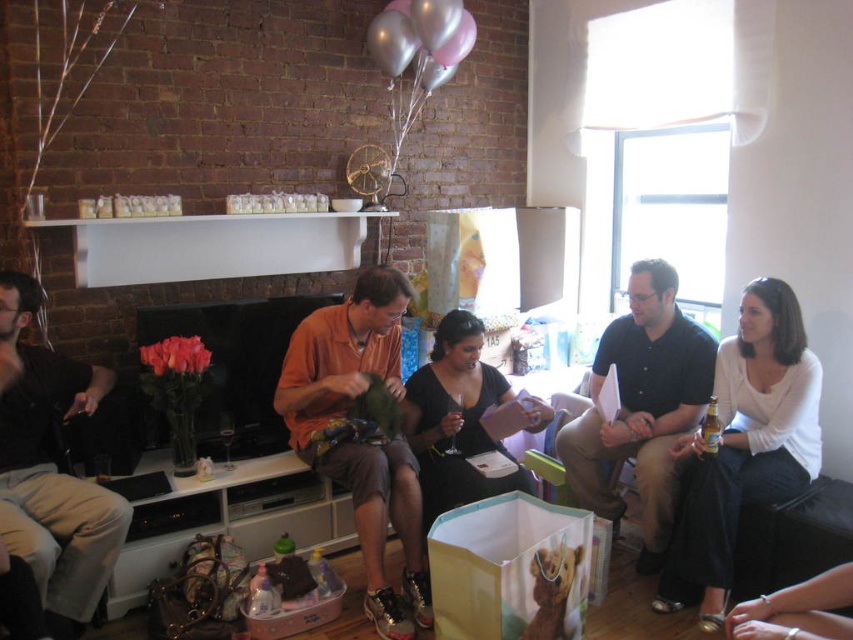
Which is more to the left, matte black shirt at left or black satin dress at center?

matte black shirt at left

Is matte black shirt at left positioned behind black satin dress at center?

That is False.

Where is `matte black shirt at left`? The width and height of the screenshot is (853, 640). matte black shirt at left is located at coordinates (51, 467).

Locate an element on the screen. This screenshot has height=640, width=853. matte black shirt at left is located at coordinates (51, 467).

Is orange cotton shirt at center closer to the viewer compared to dark blue shirt at center?

Yes, it is in front of dark blue shirt at center.

Can you confirm if orange cotton shirt at center is smaller than dark blue shirt at center?

Indeed, orange cotton shirt at center has a smaller size compared to dark blue shirt at center.

You are a GUI agent. You are given a task and a screenshot of the screen. Output one action in this format:
    pyautogui.click(x=<x>, y=<y>)
    Task: Click on the orange cotton shirt at center
    The height and width of the screenshot is (640, 853).
    Given the screenshot: What is the action you would take?
    pyautogui.click(x=360, y=433)

Is white matte shirt at right closer to the viewer compared to dark blue shirt at center?

Yes.

Based on the photo, who is more distant from viewer, (727, 477) or (695, 348)?

The point (695, 348) is more distant.

Between point (743, 426) and point (606, 452), which one is positioned behind?

The point (606, 452) is more distant.

What are the coordinates of `white matte shirt at right` in the screenshot? It's located at (744, 445).